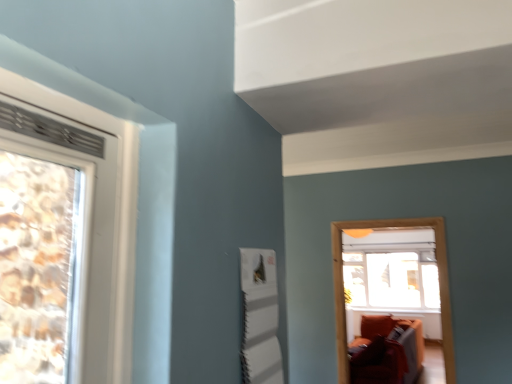
Question: From the image's perspective, is wooden frame at center on top of transparent glass window at center?

Choices:
 (A) yes
 (B) no

Answer: (A)

Question: Considering the relative positions of wooden frame at center and transparent glass window at center in the image provided, is wooden frame at center behind transparent glass window at center?

Choices:
 (A) no
 (B) yes

Answer: (A)

Question: Is wooden frame at center aimed at transparent glass window at center?

Choices:
 (A) yes
 (B) no

Answer: (B)

Question: From a real-world perspective, is wooden frame at center positioned under transparent glass window at center based on gravity?

Choices:
 (A) no
 (B) yes

Answer: (A)

Question: Does wooden frame at center have a lesser height compared to transparent glass window at center?

Choices:
 (A) no
 (B) yes

Answer: (A)

Question: Is there a large distance between wooden frame at center and transparent glass window at center?

Choices:
 (A) yes
 (B) no

Answer: (A)

Question: Is transparent glass window at center looking in the opposite direction of wooden frame at center?

Choices:
 (A) yes
 (B) no

Answer: (B)

Question: Is transparent glass window at center far from wooden frame at center?

Choices:
 (A) yes
 (B) no

Answer: (A)

Question: Is transparent glass window at center surrounding wooden frame at center?

Choices:
 (A) no
 (B) yes

Answer: (A)

Question: Considering the relative positions of transparent glass window at center and wooden frame at center in the image provided, is transparent glass window at center to the left of wooden frame at center from the viewer's perspective?

Choices:
 (A) yes
 (B) no

Answer: (B)

Question: Can we say transparent glass window at center lies outside wooden frame at center?

Choices:
 (A) no
 (B) yes

Answer: (B)

Question: Does transparent glass window at center lie behind wooden frame at center?

Choices:
 (A) yes
 (B) no

Answer: (A)

Question: From a real-world perspective, is transparent glass window at center physically located above or below wooden frame at center?

Choices:
 (A) above
 (B) below

Answer: (B)